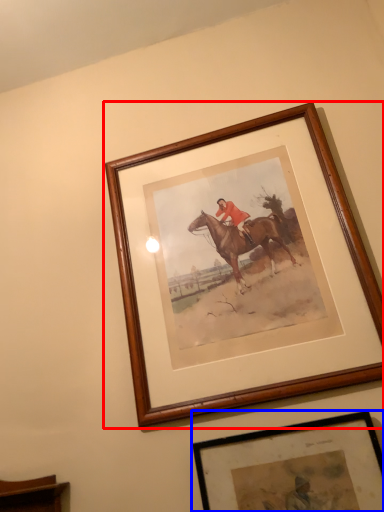
Question: Which object is further to the camera taking this photo, picture frame (highlighted by a red box) or picture frame (highlighted by a blue box)?

Choices:
 (A) picture frame
 (B) picture frame

Answer: (A)